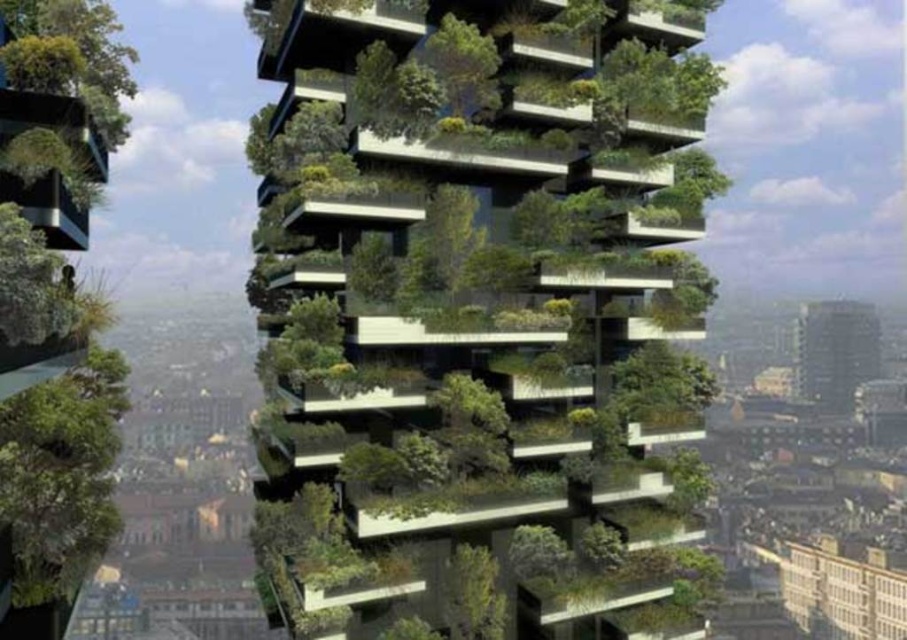
Question: Where is black glass tower at upper right located in relation to green leafy tree at left in the image?

Choices:
 (A) left
 (B) right

Answer: (B)

Question: Among these objects, which one is nearest to the camera?

Choices:
 (A) green matte tree at lower left
 (B) green matte/soft building at center

Answer: (B)

Question: Considering the relative positions of green matte/soft building at center and black glass tower at upper right in the image provided, where is green matte/soft building at center located with respect to black glass tower at upper right?

Choices:
 (A) below
 (B) above

Answer: (B)

Question: Among these points, which one is farthest from the camera?

Choices:
 (A) (57, 321)
 (B) (119, 358)

Answer: (B)

Question: Is green matte/soft building at center to the left of green leafy tree at left from the viewer's perspective?

Choices:
 (A) no
 (B) yes

Answer: (A)

Question: Which object is farther from the camera taking this photo?

Choices:
 (A) green matte/soft building at center
 (B) green leafy tree at left

Answer: (A)